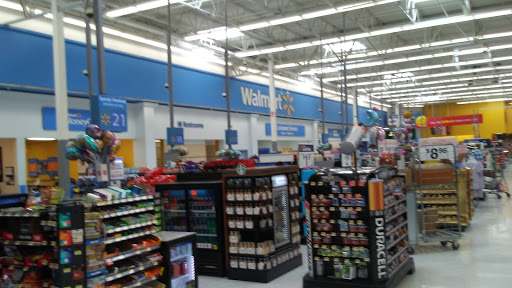
This screenshot has width=512, height=288. What are the coordinates of `rectangular shaped lightin` in the screenshot? It's located at (213, 31), (335, 48), (396, 74).